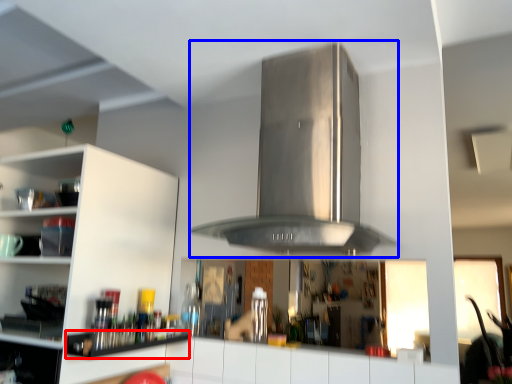
Question: Which of the following is the closest to the observer, shelf (highlighted by a red box) or vent (highlighted by a blue box)?

Choices:
 (A) shelf
 (B) vent

Answer: (B)